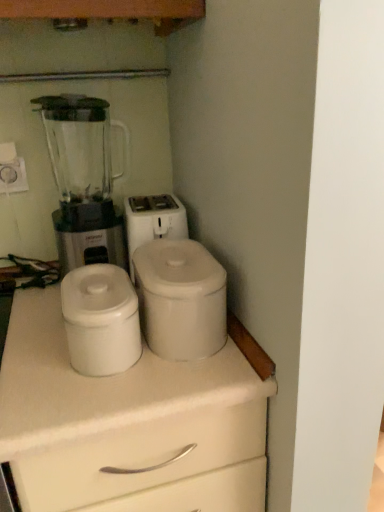
The width and height of the screenshot is (384, 512). Find the location of `empty space that is ontop of white matte canister at center, positioned as the 2th appliance in left-to-right order (from a real-world perspective)`. empty space that is ontop of white matte canister at center, positioned as the 2th appliance in left-to-right order (from a real-world perspective) is located at coordinates (172, 260).